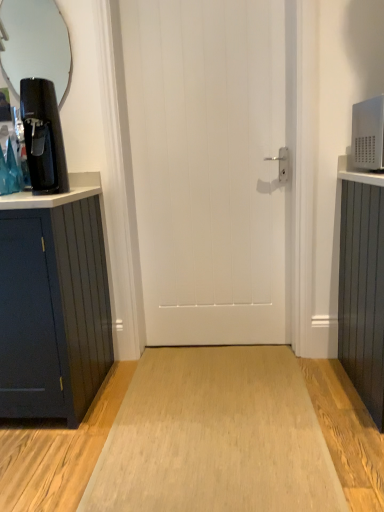
Question: Is clear glass mirror at upper left a part of white matte door at center?

Choices:
 (A) yes
 (B) no

Answer: (B)

Question: Can you confirm if white matte door at center is wider than clear glass mirror at upper left?

Choices:
 (A) yes
 (B) no

Answer: (A)

Question: From the image's perspective, is white matte door at center under clear glass mirror at upper left?

Choices:
 (A) yes
 (B) no

Answer: (A)

Question: Considering the relative sizes of white matte door at center and clear glass mirror at upper left in the image provided, is white matte door at center shorter than clear glass mirror at upper left?

Choices:
 (A) yes
 (B) no

Answer: (B)

Question: Is white matte door at center positioned in front of clear glass mirror at upper left?

Choices:
 (A) yes
 (B) no

Answer: (A)

Question: Would you say white matte door at center is a long distance from clear glass mirror at upper left?

Choices:
 (A) yes
 (B) no

Answer: (A)

Question: Does white matte door at center have a greater height compared to matte black coffee machine at left?

Choices:
 (A) no
 (B) yes

Answer: (B)

Question: Is white matte door at center bigger than matte black coffee machine at left?

Choices:
 (A) yes
 (B) no

Answer: (A)

Question: Can you confirm if white matte door at center is shorter than matte black coffee machine at left?

Choices:
 (A) yes
 (B) no

Answer: (B)

Question: Considering the relative sizes of white matte door at center and matte black coffee machine at left in the image provided, is white matte door at center smaller than matte black coffee machine at left?

Choices:
 (A) no
 (B) yes

Answer: (A)

Question: Would you say white matte door at center is outside matte black coffee machine at left?

Choices:
 (A) yes
 (B) no

Answer: (A)

Question: Is white matte door at center not near matte black coffee machine at left?

Choices:
 (A) no
 (B) yes

Answer: (A)

Question: Is clear glass mirror at upper left oriented away from matte black coffee machine at left?

Choices:
 (A) yes
 (B) no

Answer: (B)